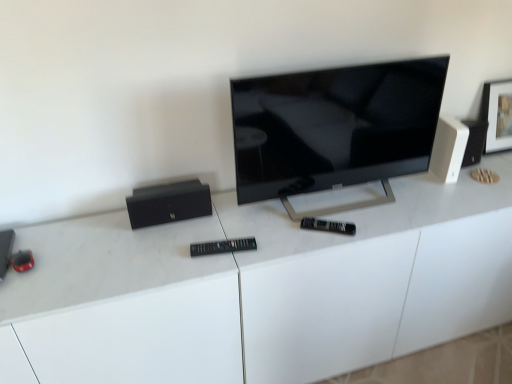
Locate an element on the screen. blank space above white glossy desk at center (from a real-world perspective) is located at coordinates (293, 220).